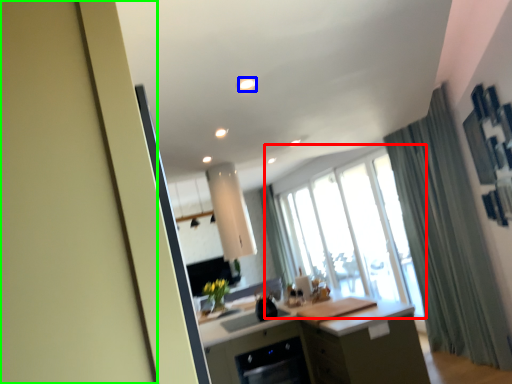
Question: Which object is positioned closest to window (highlighted by a red box)? Select from light (highlighted by a blue box) and screen door (highlighted by a green box).

Choices:
 (A) light
 (B) screen door

Answer: (A)